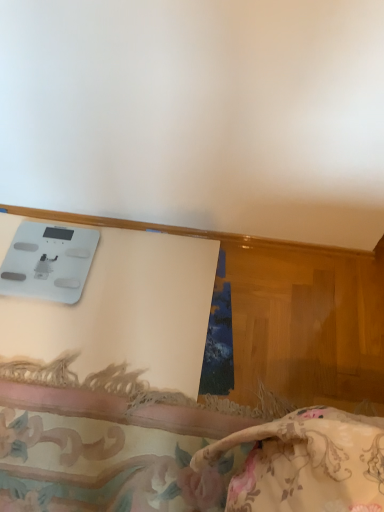
This screenshot has width=384, height=512. I want to click on vacant space underneath white wood trim at upper center (from a real-world perspective), so click(273, 242).